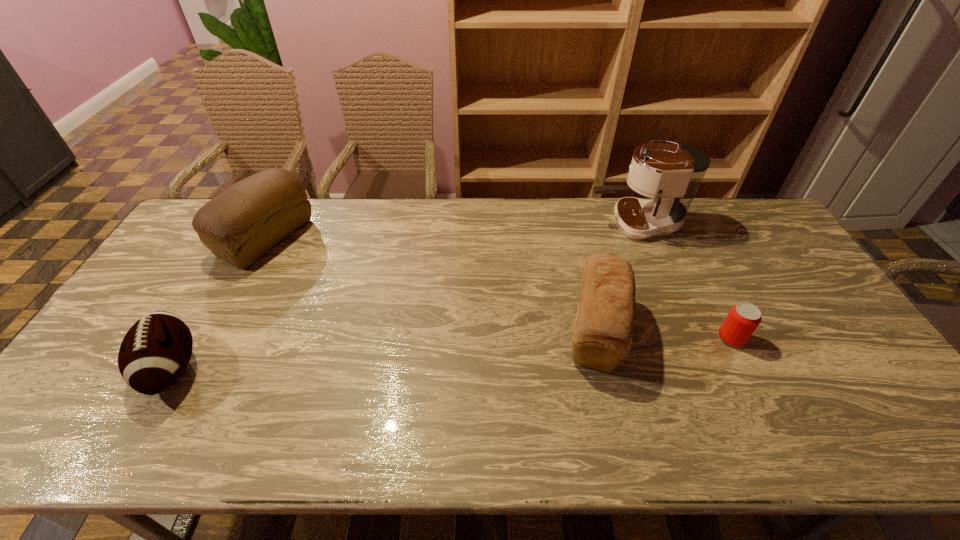
The image size is (960, 540). Find the location of `object that stands as the second closest to the left bread`. object that stands as the second closest to the left bread is located at coordinates (602, 337).

You are a GUI agent. You are given a task and a screenshot of the screen. Output one action in this format:
    pyautogui.click(x=<x>, y=<y>)
    Task: Click on the free location that satisfies the following two spatial constraints: 1. on the front side of the nearer bread; 2. on the left side of the farther bread
    This screenshot has width=960, height=540.
    Given the screenshot: What is the action you would take?
    click(216, 330)

Locate an element on the screen. Image resolution: width=960 pixels, height=540 pixels. free space that satisfies the following two spatial constraints: 1. on the back side of the football (American); 2. on the left side of the right bread is located at coordinates (194, 330).

Locate an element on the screen. This screenshot has width=960, height=540. free space that satisfies the following two spatial constraints: 1. on the front-facing side of the tallest object; 2. on the front side of the nearer bread is located at coordinates (677, 330).

This screenshot has width=960, height=540. In order to click on free space that satisfies the following two spatial constraints: 1. on the back side of the football (American); 2. on the right side of the beer can in this screenshot , I will do `click(189, 338)`.

You are a GUI agent. You are given a task and a screenshot of the screen. Output one action in this format:
    pyautogui.click(x=<x>, y=<y>)
    Task: Click on the free space that satisfies the following two spatial constraints: 1. on the front side of the shortest object; 2. on the left side of the right bread
    The image size is (960, 540).
    Given the screenshot: What is the action you would take?
    pyautogui.click(x=598, y=338)